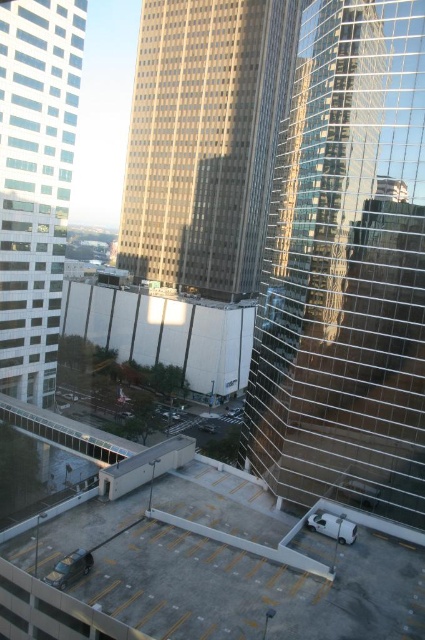
You are a city planner reviewing this area. You need to decide which building to place a new antenna on. The antenna requires the building to be taller. Which building should you choose between the reflective glass tower at right and the gold glass skyscraper at center?

The gold glass skyscraper at center is larger in size than the reflective glass tower at right, so the antenna should be placed on the gold glass skyscraper at center.

You are standing in the middle of the parking lot and want to take a photo of the white glass building at left and the white matte parking garage at center. Which object should you focus on first to ensure it appears larger in your photo?

The white glass building at left is closer to the viewer than the white matte parking garage at center, so focusing on it first will make it appear larger in the photo.